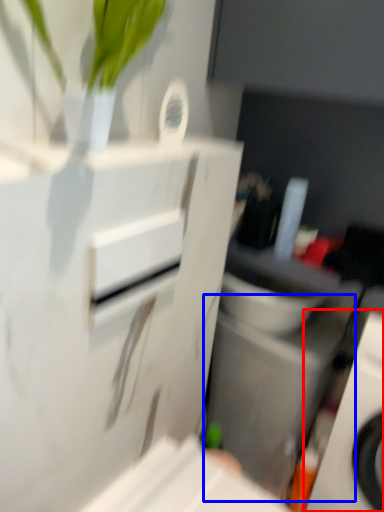
Question: Among these objects, which one is nearest to the camera, home appliance (highlighted by a red box) or appliance (highlighted by a blue box)?

Choices:
 (A) home appliance
 (B) appliance

Answer: (A)